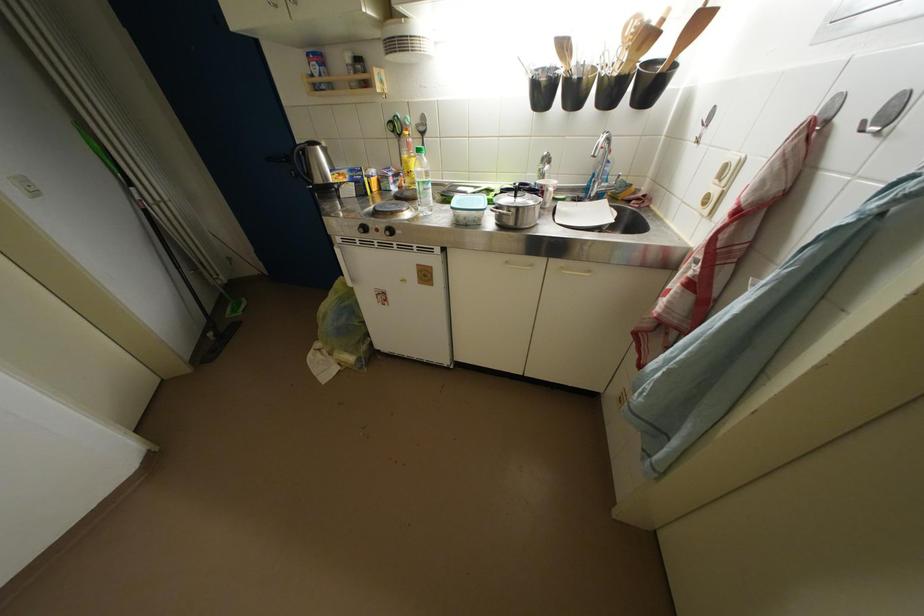
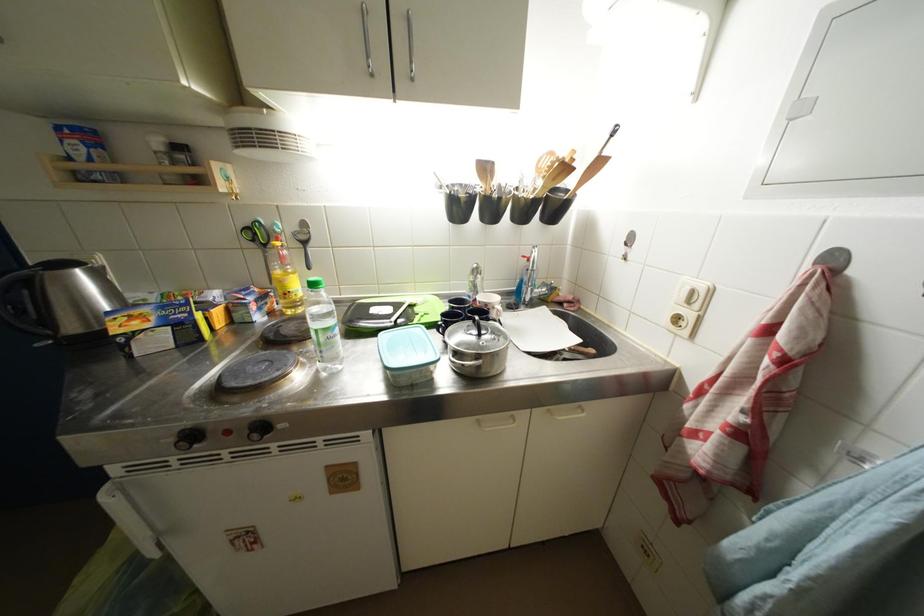
Find the pixel in the second image that matches point 397,235 in the first image.

(269, 431)